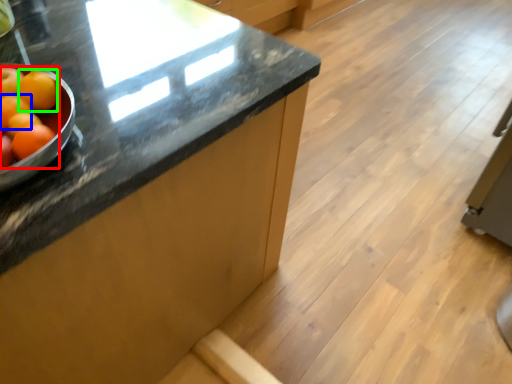
Question: Estimate the real-world distances between objects in this image. Which object is closer to grapefruit (highlighted by a red box), orange (highlighted by a blue box) or tangerine (highlighted by a green box)?

Choices:
 (A) orange
 (B) tangerine

Answer: (B)